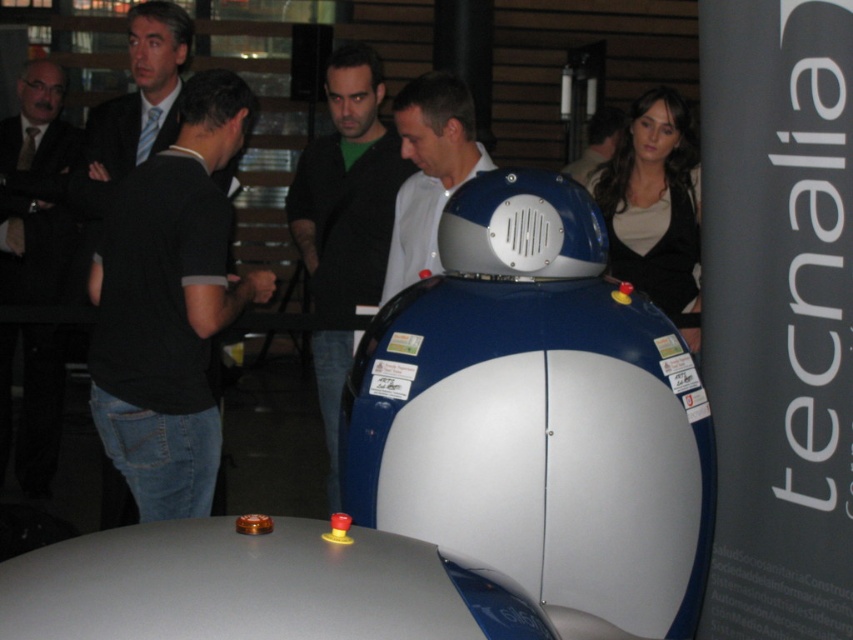
Does black cotton shirt at left have a greater width compared to dark green shirt at center?

Correct, the width of black cotton shirt at left exceeds that of dark green shirt at center.

Between black cotton shirt at left and dark green shirt at center, which one appears on the right side from the viewer's perspective?

dark green shirt at center

Is point (212, 128) in front of point (339, 380)?

That is True.

Identify the location of black cotton shirt at left. The image size is (853, 640). (170, 305).

Is point (267, 273) behind point (32, 131)?

That is False.

Can you confirm if black cotton shirt at left is positioned above dark suit at left?

Yes, black cotton shirt at left is above dark suit at left.

Who is more distant from viewer, (141, 445) or (32, 211)?

Point (32, 211)

The width and height of the screenshot is (853, 640). I want to click on black cotton shirt at left, so click(170, 305).

Is dark suit at left wider than dark blue shirt at upper center?

No, dark suit at left is not wider than dark blue shirt at upper center.

You are a GUI agent. You are given a task and a screenshot of the screen. Output one action in this format:
    pyautogui.click(x=<x>, y=<y>)
    Task: Click on the dark suit at left
    This screenshot has height=640, width=853.
    Given the screenshot: What is the action you would take?
    pyautogui.click(x=32, y=250)